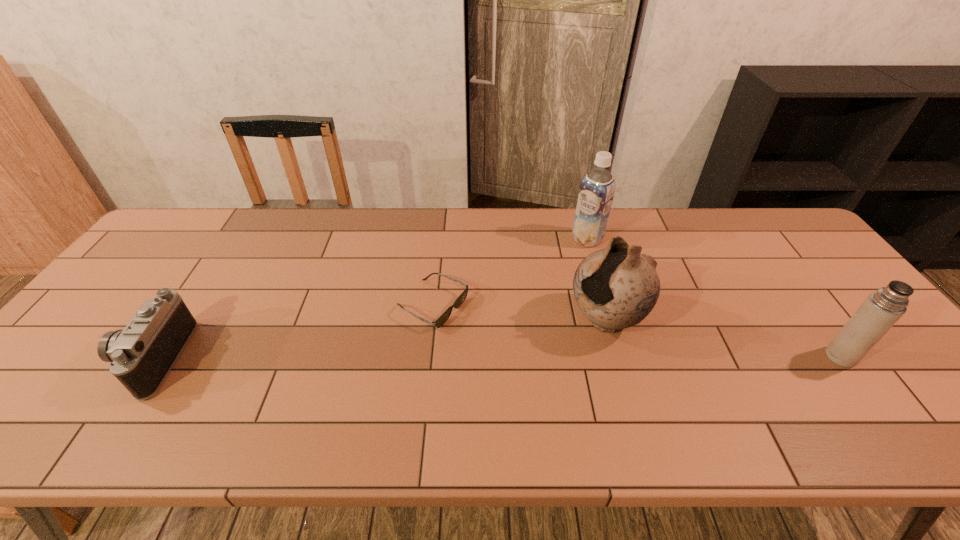
The image size is (960, 540). Identify the location of free point between the third shortest object and the leftmost object. (497, 357).

Identify the location of free spot between the sunglasses and the pottery. (519, 313).

Image resolution: width=960 pixels, height=540 pixels. In order to click on free space between the leftmost object and the pottery in this screenshot , I will do `click(379, 339)`.

This screenshot has width=960, height=540. Find the location of `free space between the pottery and the leftmost object`. free space between the pottery and the leftmost object is located at coordinates (379, 339).

The width and height of the screenshot is (960, 540). Identify the location of vacant area that lies between the leftmost object and the pottery. (x=379, y=339).

At what (x,y) coordinates should I click in order to perform the action: click on empty space that is in between the soya milk and the leftmost object. Please return your answer as a coordinate pair (x, y). Looking at the image, I should click on (371, 299).

Locate an element on the screen. The image size is (960, 540). empty space between the farthest object and the third tallest object is located at coordinates (714, 298).

At what (x,y) coordinates should I click in order to perform the action: click on blank region between the sunglasses and the farthest object. Please return your answer as a coordinate pair (x, y). The image size is (960, 540). Looking at the image, I should click on (510, 272).

I want to click on free space between the shortest object and the pottery, so (x=519, y=313).

Where is `object that is the second closest to the third shortest object`? object that is the second closest to the third shortest object is located at coordinates (596, 193).